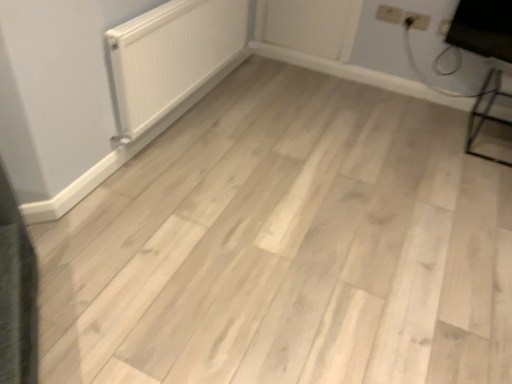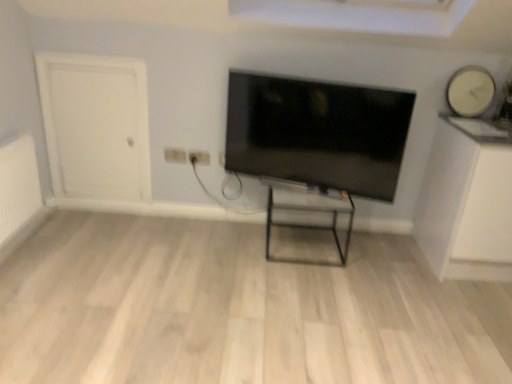
Question: Which way did the camera rotate in the video?

Choices:
 (A) rotated downward
 (B) rotated upward

Answer: (B)